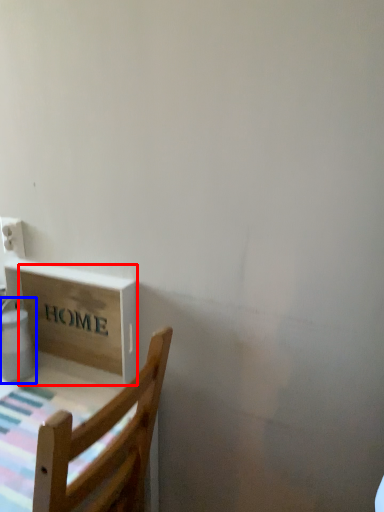
Question: Which object is further to the camera taking this photo, cardboard box (highlighted by a red box) or water heater (highlighted by a blue box)?

Choices:
 (A) cardboard box
 (B) water heater

Answer: (B)